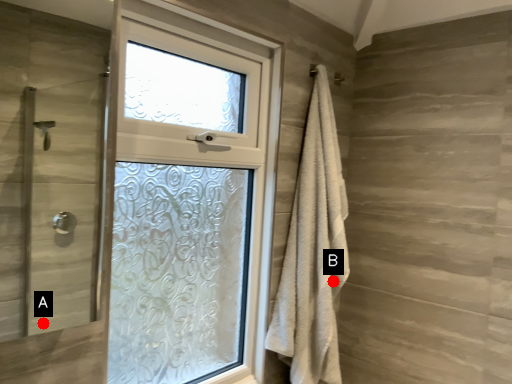
Question: Two points are circled on the image, labeled by A and B beside each circle. Which point is closer to the camera taking this photo?

Choices:
 (A) A is closer
 (B) B is closer

Answer: (B)